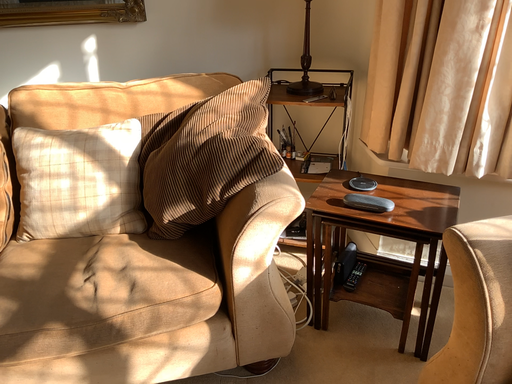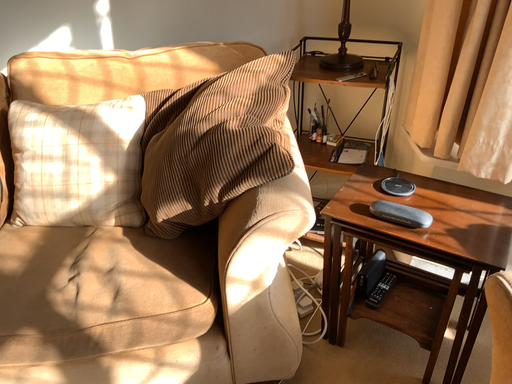
Question: How did the camera likely rotate when shooting the video?

Choices:
 (A) rotated right
 (B) rotated left

Answer: (B)